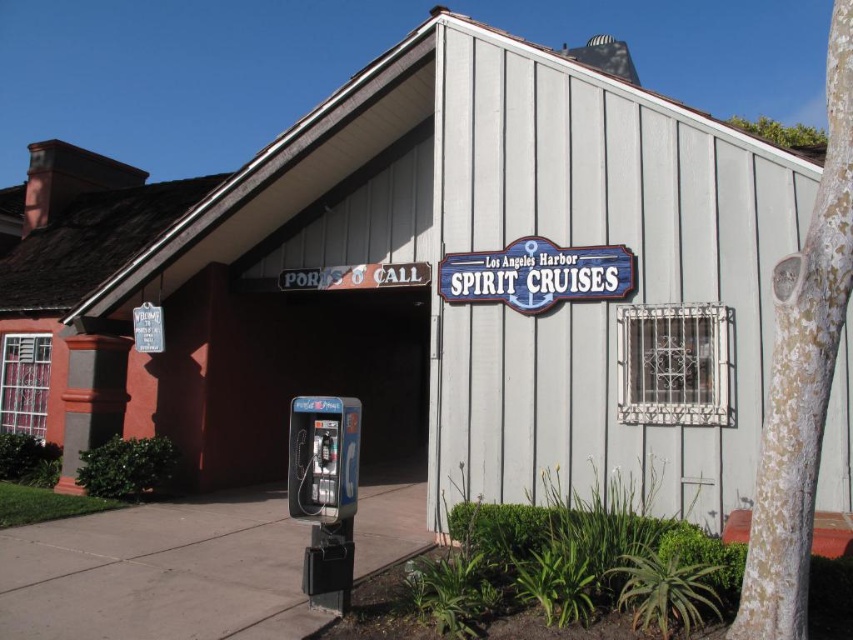
You are a tourist trying to find the entrance to the Los Angeles Harbor Spirit Cruises. You see the gray concrete sidewalk at lower left and the metallic gray parking meter at lower left. Which object is closer to the entrance?

The gray concrete sidewalk at lower left is shorter than the metallic gray parking meter at lower left, so the sidewalk is closer to the entrance because shorter objects are typically placed nearer in such scenes.

You are a tourist trying to find the entrance to the Los Angeles Harbor Spirit Cruises. You see a metallic gray parking meter at lower left and a blue wooden sign at upper center. Which object is closer to the entrance?

The metallic gray parking meter at lower left is smaller than the blue wooden sign at upper center, but this does not indicate proximity. The entrance is indicated by the sign reading Ports o Call above the doorway, so the blue wooden sign at upper center is likely closer to the entrance as it is part of the building structure.